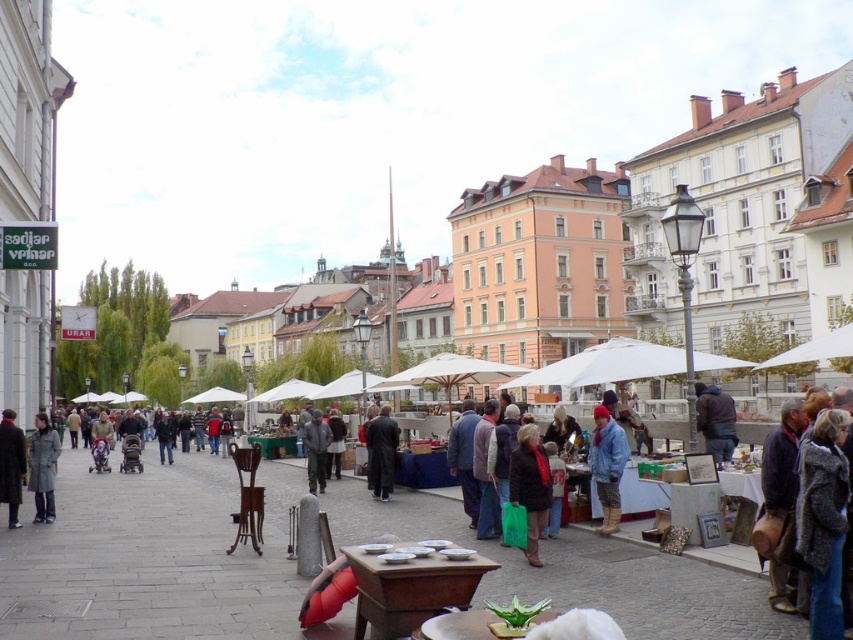
Based on the photo, you are a customer at this market and want to pick up both the denim jacket at center and the dark brown leather coat at center. Which item should you reach for first if you want to grab the one closer to you first?

The denim jacket at center is closer to the viewer than the dark brown leather coat at center, so you should reach for the denim jacket at center first.

You are a customer at the market and want to hang both the brown leather jacket at center and the denim jacket at center on a single hanger. The hanger can only hold items up to the height of the taller jacket. Which jacket determines the maximum height the hanger must accommodate?

The denim jacket at center is taller than the brown leather jacket at center, so the hanger must accommodate the height of the denim jacket at center.